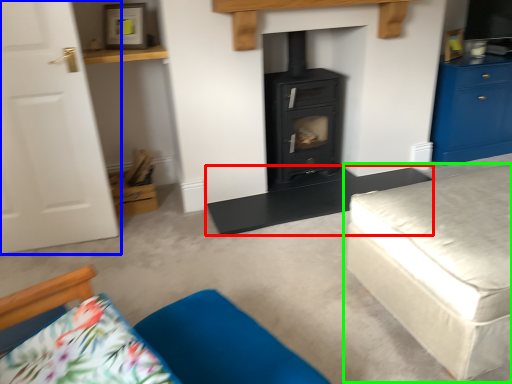
Question: Which object is the closest to the table (highlighted by a red box)? Choose among these: door (highlighted by a blue box) or studio couch (highlighted by a green box).

Choices:
 (A) door
 (B) studio couch

Answer: (B)